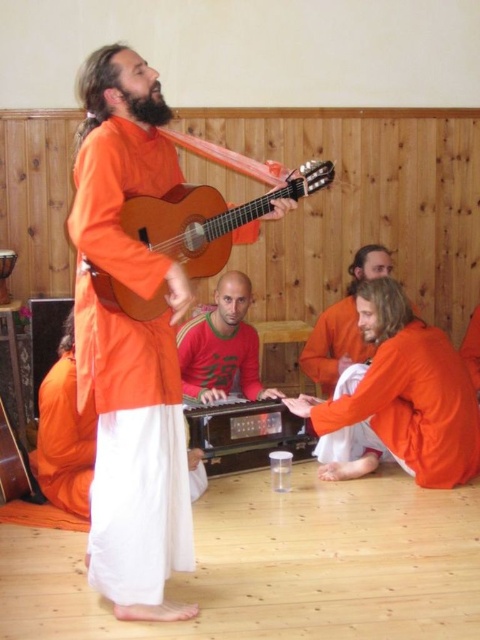
Is matte orange guitar at center bigger than wooden acoustic guitar at center?

Yes, matte orange guitar at center is bigger than wooden acoustic guitar at center.

Can you confirm if matte orange guitar at center is positioned to the right of wooden acoustic guitar at center?

Incorrect, matte orange guitar at center is not on the right side of wooden acoustic guitar at center.

Between point (121, 365) and point (222, 234), which one is positioned in front?

Point (121, 365) is more forward.

Find the location of `matte orange guitar at center`. matte orange guitar at center is located at coordinates (130, 342).

Does orange cotton robe at center have a greater height compared to red matte sweater at center?

Indeed, orange cotton robe at center has a greater height compared to red matte sweater at center.

Is point (97, 323) in front of point (233, 365)?

Yes, it is in front of point (233, 365).

Where is `orange cotton robe at center`? orange cotton robe at center is located at coordinates (129, 374).

Is wooden acoustic guitar at center below red matte sweater at center?

No.

Which is in front, point (166, 195) or point (237, 321)?

Positioned in front is point (166, 195).

What are the coordinates of `wooden acoustic guitar at center` in the screenshot? It's located at (208, 218).